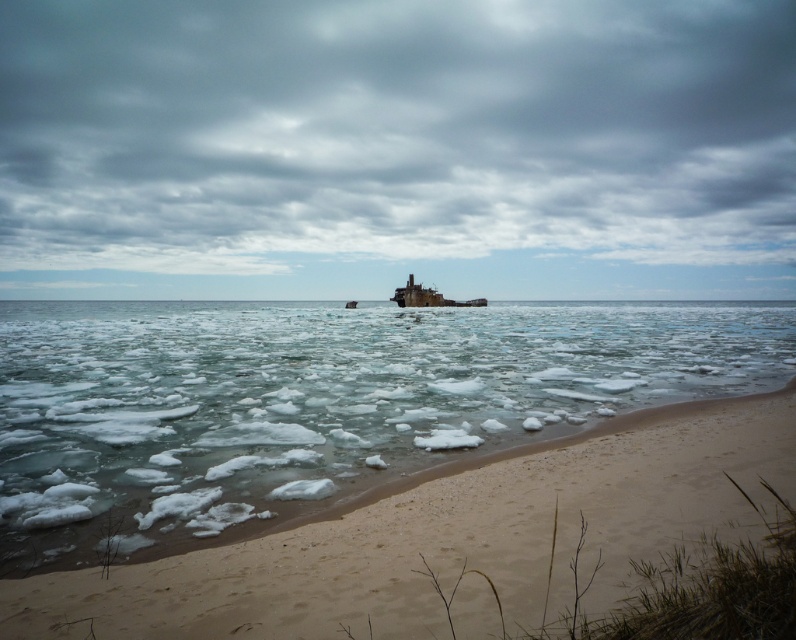
Does translucent ice at center lie behind rusty metal shipwreck at center?

No, translucent ice at center is closer to the viewer.

Does translucent ice at center have a smaller size compared to rusty metal shipwreck at center?

Incorrect, translucent ice at center is not smaller in size than rusty metal shipwreck at center.

Between point (22, 369) and point (434, 292), which one is positioned behind?

The point (434, 292) is behind.

Image resolution: width=796 pixels, height=640 pixels. Identify the location of translucent ice at center. (315, 400).

Is cloudy sky at upper center above rusty metal shipwreck at center?

Indeed, cloudy sky at upper center is positioned over rusty metal shipwreck at center.

Is point (625, 45) positioned in front of point (400, 305)?

No.

I want to click on cloudy sky at upper center, so click(396, 148).

Does cloudy sky at upper center appear under translucent ice at center?

Actually, cloudy sky at upper center is above translucent ice at center.

I want to click on cloudy sky at upper center, so click(396, 148).